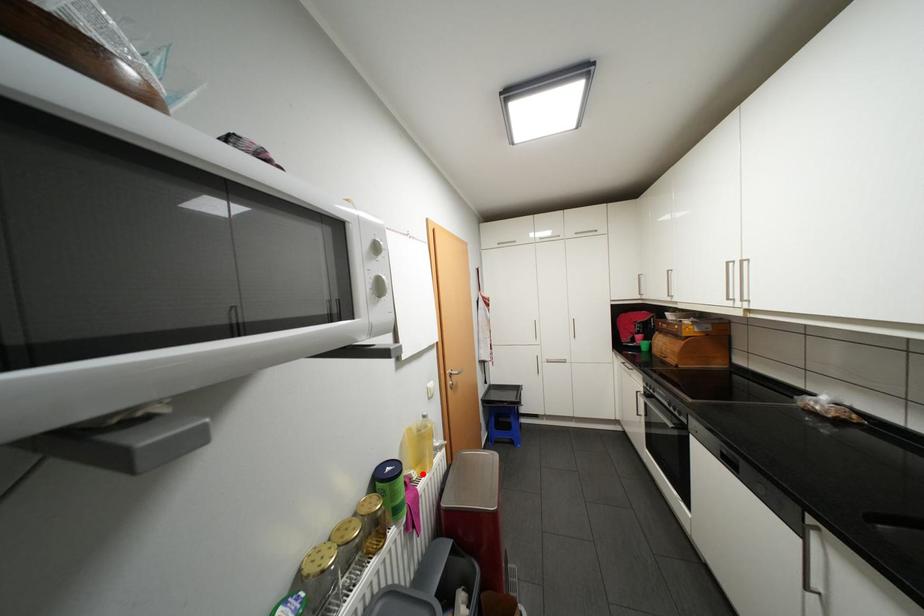
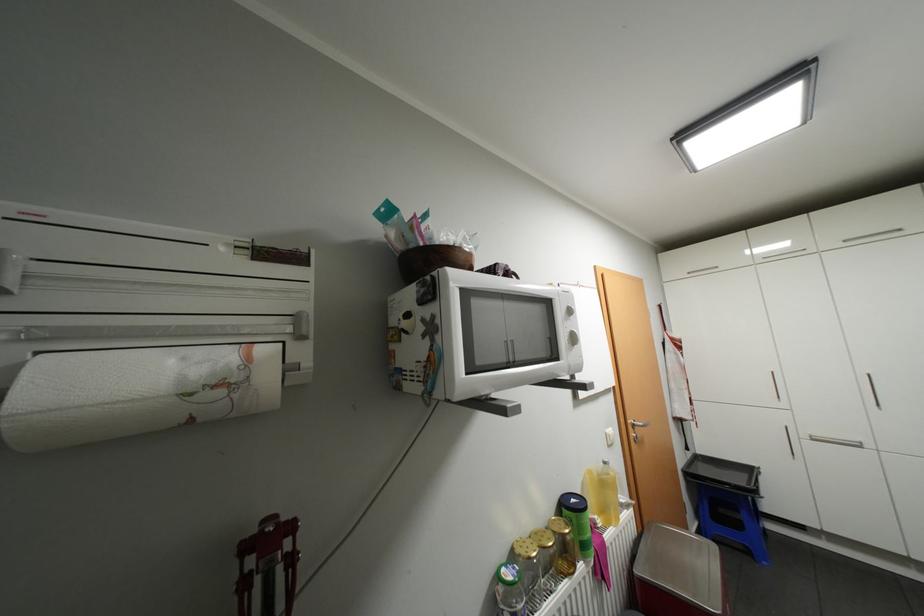
Question: I am providing you with two images of the same scene from different viewpoints. Image1 has a red point marked. In image2, the corresponding 3D location appears at what relative position? Reply with the corresponding letter.

Choices:
 (A) Closer
 (B) Farther

Answer: (B)